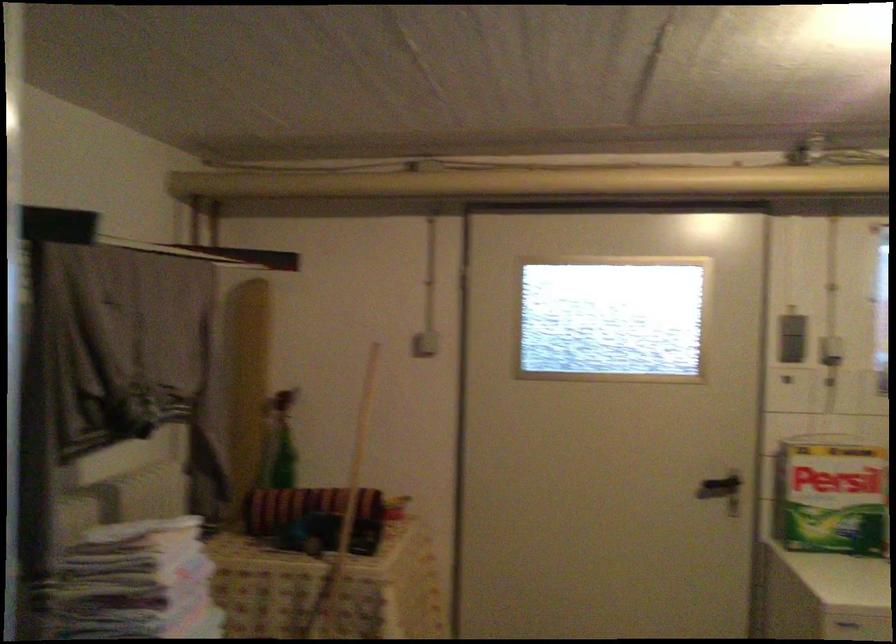
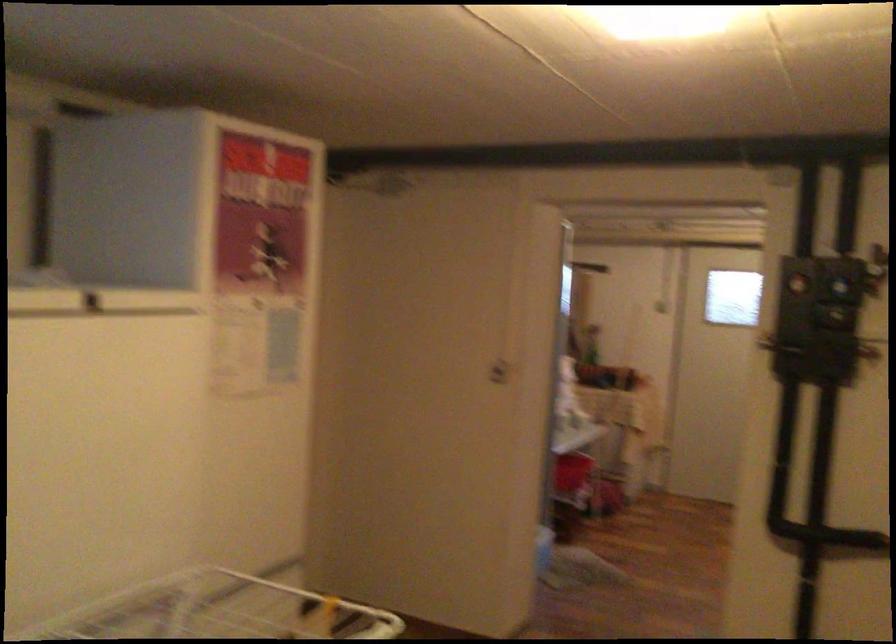
Question: I am providing you with two images of the same scene from different viewpoints. After the viewpoint changes to image2, which objects are now occluded?

Choices:
 (A) refrigerator door handle
 (B) blue control dial
 (C) white light switch
 (D) white hanging pot

Answer: (C)